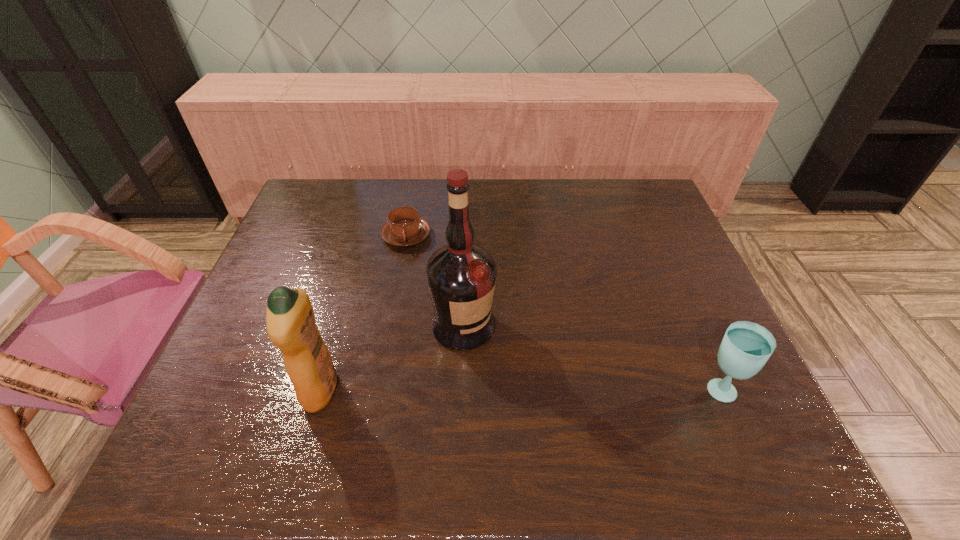
This screenshot has height=540, width=960. Find the location of `detergent`. detergent is located at coordinates (290, 321).

Where is `the leftmost object`? the leftmost object is located at coordinates (290, 321).

You are a GUI agent. You are given a task and a screenshot of the screen. Output one action in this format:
    pyautogui.click(x=<x>, y=<y>)
    Task: Click on the rightmost object
    The width and height of the screenshot is (960, 540).
    Given the screenshot: What is the action you would take?
    pyautogui.click(x=746, y=346)

The height and width of the screenshot is (540, 960). Find the location of `glass`. glass is located at coordinates [x=746, y=346].

Where is `the shortest object`? The image size is (960, 540). the shortest object is located at coordinates (404, 228).

I want to click on the second object from left to right, so click(x=404, y=228).

Where is `the tallest object`? the tallest object is located at coordinates (461, 276).

Where is `liquor`? This screenshot has width=960, height=540. liquor is located at coordinates (461, 276).

This screenshot has width=960, height=540. I want to click on vacant space located 0.110m on the label of the second tallest object, so click(256, 389).

The image size is (960, 540). Identify the location of free spot located on the label of the second tallest object. (278, 389).